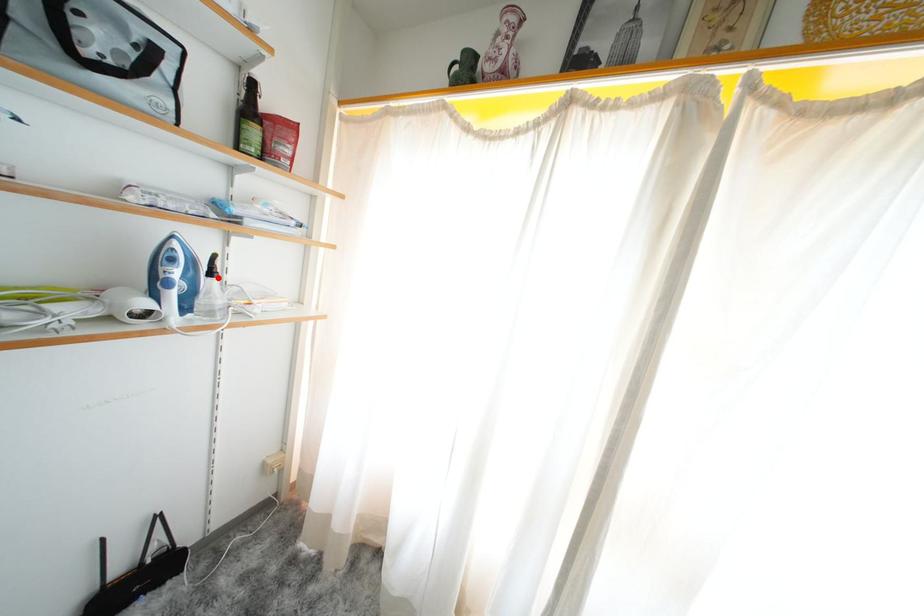
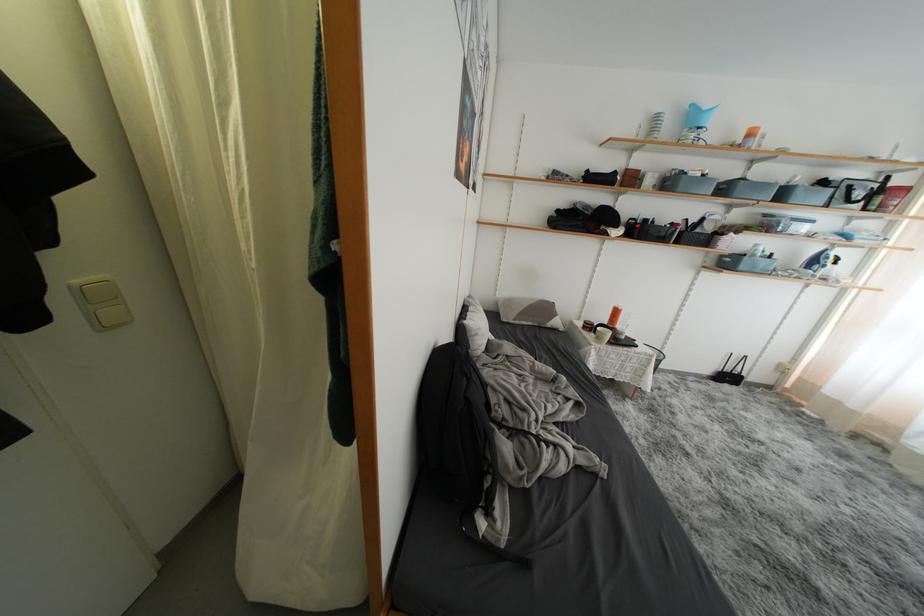
Question: I am providing you with two images of the same scene from different viewpoints. A red point is shown in image1. For the corresponding object point in image2, is it positioned nearer or farther from the camera?

Choices:
 (A) Nearer
 (B) Farther

Answer: (B)